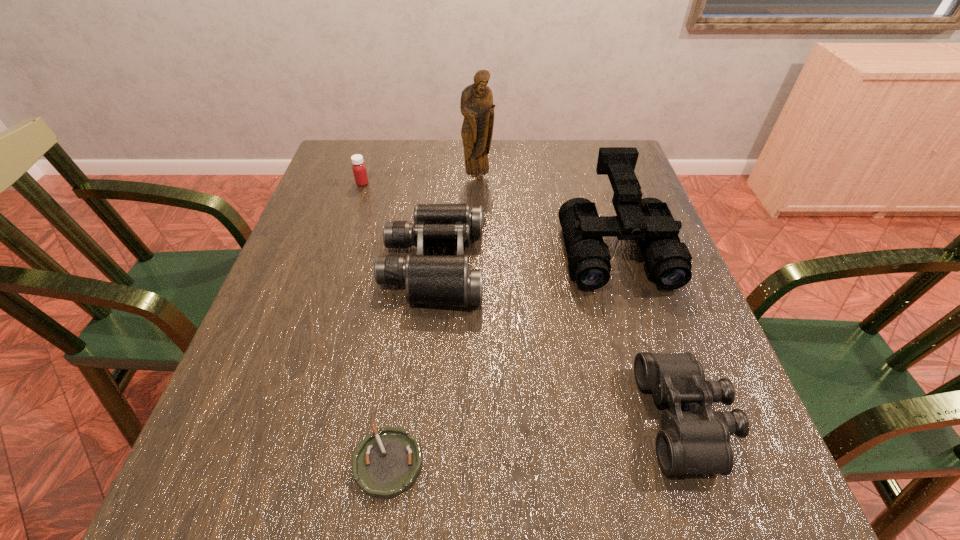
Locate which binoculars is the closest to the tallest object. Please provide its 2D coordinates. Your answer should be formatted as a tuple, i.e. [(x, y)], where the tuple contains the x and y coordinates of a point satisfying the conditions above.

[(445, 280)]